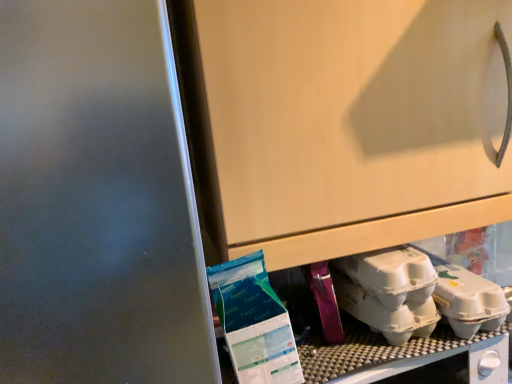
The width and height of the screenshot is (512, 384). What do you see at coordinates (389, 291) in the screenshot?
I see `white matte egg carton at lower right, arranged as the second yoghurt when viewed from the left` at bounding box center [389, 291].

Where is `white matte egg carton at lower right, which is the first yoghurt in right-to-left order`? white matte egg carton at lower right, which is the first yoghurt in right-to-left order is located at coordinates (x=389, y=291).

This screenshot has height=384, width=512. I want to click on blue plastic bag of yoghurt at lower left, positioned as the 2th yoghurt in right-to-left order, so click(254, 322).

In order to face blue plastic bag of yoghurt at lower left, positioned as the 2th yoghurt in right-to-left order, should I rotate leftwards or rightwards?

Rotate left and turn 0.181 degrees.

Describe the element at coordinates (254, 322) in the screenshot. I see `blue plastic bag of yoghurt at lower left, positioned as the 2th yoghurt in right-to-left order` at that location.

You are a GUI agent. You are given a task and a screenshot of the screen. Output one action in this format:
    pyautogui.click(x=<x>, y=<y>)
    Task: Click on the white matte egg carton at lower right, which is the first yoghurt in right-to-left order
    This screenshot has height=384, width=512.
    Given the screenshot: What is the action you would take?
    pos(389,291)

In the scene shown: Is white matte egg carton at lower right, which is the first yoghurt in right-to-left order, at the left side of blue plastic bag of yoghurt at lower left, positioned as the 2th yoghurt in right-to-left order?

Incorrect, white matte egg carton at lower right, which is the first yoghurt in right-to-left order, is not on the left side of blue plastic bag of yoghurt at lower left, positioned as the 2th yoghurt in right-to-left order.

Looking at this image, is white matte egg carton at lower right, arranged as the second yoghurt when viewed from the left, positioned in front of blue plastic bag of yoghurt at lower left, positioned as the 2th yoghurt in right-to-left order?

No, it is behind blue plastic bag of yoghurt at lower left, positioned as the 2th yoghurt in right-to-left order.

Is point (407, 297) closer or farther from the camera than point (248, 271)?

Point (407, 297) appears to be farther away from the viewer than point (248, 271).

Looking at this image, from the image's perspective, who appears lower, white matte egg carton at lower right, which is the first yoghurt in right-to-left order, or blue plastic bag of yoghurt at lower left, positioned as the 2th yoghurt in right-to-left order?

From the image's view, white matte egg carton at lower right, which is the first yoghurt in right-to-left order, is below.

From a real-world perspective, is white matte egg carton at lower right, which is the first yoghurt in right-to-left order, below blue plastic bag of yoghurt at lower left, positioned as the 2th yoghurt in right-to-left order?

Yes.

Which of these two, white matte egg carton at lower right, which is the first yoghurt in right-to-left order, or blue plastic bag of yoghurt at lower left, positioned as the 2th yoghurt in right-to-left order, is wider?

With larger width is white matte egg carton at lower right, which is the first yoghurt in right-to-left order.

Is white matte egg carton at lower right, arranged as the second yoghurt when viewed from the left, shorter than blue plastic bag of yoghurt at lower left, placed as the first yoghurt when sorted from left to right?

Correct, white matte egg carton at lower right, arranged as the second yoghurt when viewed from the left, is not as tall as blue plastic bag of yoghurt at lower left, placed as the first yoghurt when sorted from left to right.

Can you confirm if white matte egg carton at lower right, which is the first yoghurt in right-to-left order, is smaller than blue plastic bag of yoghurt at lower left, placed as the first yoghurt when sorted from left to right?

Indeed, white matte egg carton at lower right, which is the first yoghurt in right-to-left order, has a smaller size compared to blue plastic bag of yoghurt at lower left, placed as the first yoghurt when sorted from left to right.

Do you think white matte egg carton at lower right, which is the first yoghurt in right-to-left order, is within blue plastic bag of yoghurt at lower left, placed as the first yoghurt when sorted from left to right, or outside of it?

white matte egg carton at lower right, which is the first yoghurt in right-to-left order, lies outside blue plastic bag of yoghurt at lower left, placed as the first yoghurt when sorted from left to right.

Are white matte egg carton at lower right, arranged as the second yoghurt when viewed from the left, and blue plastic bag of yoghurt at lower left, positioned as the 2th yoghurt in right-to-left order, making contact?

They are not placed beside each other.

Is white matte egg carton at lower right, arranged as the second yoghurt when viewed from the left, facing towards blue plastic bag of yoghurt at lower left, placed as the first yoghurt when sorted from left to right?

No, white matte egg carton at lower right, arranged as the second yoghurt when viewed from the left, does not turn towards blue plastic bag of yoghurt at lower left, placed as the first yoghurt when sorted from left to right.

The image size is (512, 384). Identify the location of yoghurt above the white matte egg carton at lower right, arranged as the second yoghurt when viewed from the left (from a real-world perspective). (254, 322).

Consider the image. Considering the relative positions of blue plastic bag of yoghurt at lower left, positioned as the 2th yoghurt in right-to-left order, and white matte egg carton at lower right, arranged as the second yoghurt when viewed from the left, in the image provided, is blue plastic bag of yoghurt at lower left, positioned as the 2th yoghurt in right-to-left order, to the left or to the right of white matte egg carton at lower right, arranged as the second yoghurt when viewed from the left,?

Based on their positions, blue plastic bag of yoghurt at lower left, positioned as the 2th yoghurt in right-to-left order, is located to the left of white matte egg carton at lower right, arranged as the second yoghurt when viewed from the left.

From the picture: Which object is more forward, blue plastic bag of yoghurt at lower left, placed as the first yoghurt when sorted from left to right, or white matte egg carton at lower right, which is the first yoghurt in right-to-left order?

blue plastic bag of yoghurt at lower left, placed as the first yoghurt when sorted from left to right.

Is point (247, 350) closer to camera compared to point (349, 278)?

Yes, it is.

From the image's perspective, which is below, blue plastic bag of yoghurt at lower left, placed as the first yoghurt when sorted from left to right, or white matte egg carton at lower right, arranged as the second yoghurt when viewed from the left?

white matte egg carton at lower right, arranged as the second yoghurt when viewed from the left, is shown below in the image.

From a real-world perspective, is blue plastic bag of yoghurt at lower left, placed as the first yoghurt when sorted from left to right, located beneath white matte egg carton at lower right, which is the first yoghurt in right-to-left order?

Incorrect, from a real-world perspective, blue plastic bag of yoghurt at lower left, placed as the first yoghurt when sorted from left to right, is higher than white matte egg carton at lower right, which is the first yoghurt in right-to-left order.

Considering the relative sizes of blue plastic bag of yoghurt at lower left, positioned as the 2th yoghurt in right-to-left order, and white matte egg carton at lower right, arranged as the second yoghurt when viewed from the left, in the image provided, is blue plastic bag of yoghurt at lower left, positioned as the 2th yoghurt in right-to-left order, wider than white matte egg carton at lower right, arranged as the second yoghurt when viewed from the left,?

In fact, blue plastic bag of yoghurt at lower left, positioned as the 2th yoghurt in right-to-left order, might be narrower than white matte egg carton at lower right, arranged as the second yoghurt when viewed from the left.

Is blue plastic bag of yoghurt at lower left, positioned as the 2th yoghurt in right-to-left order, taller than white matte egg carton at lower right, arranged as the second yoghurt when viewed from the left?

Indeed, blue plastic bag of yoghurt at lower left, positioned as the 2th yoghurt in right-to-left order, has a greater height compared to white matte egg carton at lower right, arranged as the second yoghurt when viewed from the left.

Is blue plastic bag of yoghurt at lower left, positioned as the 2th yoghurt in right-to-left order, bigger than white matte egg carton at lower right, arranged as the second yoghurt when viewed from the left?

Correct, blue plastic bag of yoghurt at lower left, positioned as the 2th yoghurt in right-to-left order, is larger in size than white matte egg carton at lower right, arranged as the second yoghurt when viewed from the left.

Choose the correct answer: Is blue plastic bag of yoghurt at lower left, positioned as the 2th yoghurt in right-to-left order, inside white matte egg carton at lower right, arranged as the second yoghurt when viewed from the left, or outside it?

blue plastic bag of yoghurt at lower left, positioned as the 2th yoghurt in right-to-left order, is outside white matte egg carton at lower right, arranged as the second yoghurt when viewed from the left.

Is blue plastic bag of yoghurt at lower left, positioned as the 2th yoghurt in right-to-left order, beside white matte egg carton at lower right, arranged as the second yoghurt when viewed from the left?

They are not placed beside each other.

Is blue plastic bag of yoghurt at lower left, positioned as the 2th yoghurt in right-to-left order, positioned with its back to white matte egg carton at lower right, arranged as the second yoghurt when viewed from the left?

That's not correct — blue plastic bag of yoghurt at lower left, positioned as the 2th yoghurt in right-to-left order, is not looking away from white matte egg carton at lower right, arranged as the second yoghurt when viewed from the left.

What are the coordinates of `yoghurt on the right of blue plastic bag of yoghurt at lower left, placed as the first yoghurt when sorted from left to right` in the screenshot? It's located at (389, 291).

Locate an element on the screen. The width and height of the screenshot is (512, 384). yoghurt lying in front of the white matte egg carton at lower right, which is the first yoghurt in right-to-left order is located at coordinates (254, 322).

Locate an element on the screen. Image resolution: width=512 pixels, height=384 pixels. yoghurt below the blue plastic bag of yoghurt at lower left, positioned as the 2th yoghurt in right-to-left order (from a real-world perspective) is located at coordinates (389, 291).